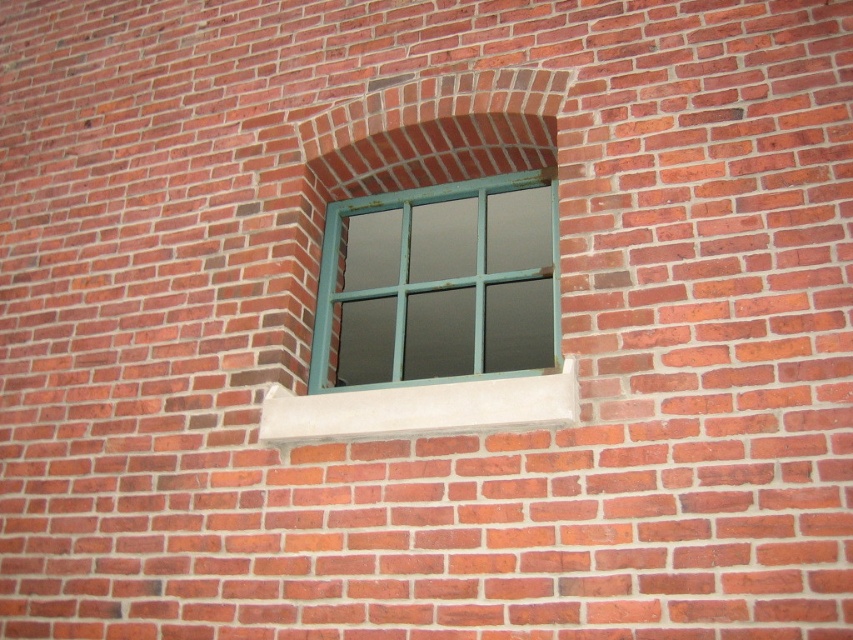
Does green painted wood window at center have a larger size compared to white concrete at center?

Yes.

Is green painted wood window at center smaller than white concrete at center?

No.

Locate an element on the screen. green painted wood window at center is located at coordinates (438, 284).

Can you confirm if teal painted wood window frame at center is shorter than white concrete at center?

No.

Which is in front, point (508, 381) or point (544, 385)?

Positioned in front is point (544, 385).

What do you see at coordinates (421, 408) in the screenshot? I see `teal painted wood window frame at center` at bounding box center [421, 408].

Identify the location of teal painted wood window frame at center. The width and height of the screenshot is (853, 640). (421, 408).

Does green painted wood window at center appear on the left side of teal painted wood window frame at center?

Incorrect, green painted wood window at center is not on the left side of teal painted wood window frame at center.

Is point (553, 262) positioned behind point (421, 429)?

Yes, it is behind point (421, 429).

Does point (550, 186) lie behind point (416, 93)?

Yes, it is behind point (416, 93).

What are the coordinates of `green painted wood window at center` in the screenshot? It's located at (438, 284).